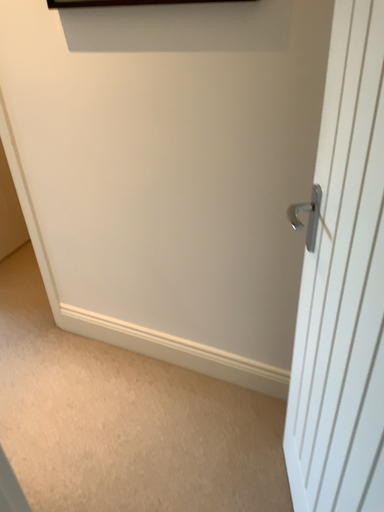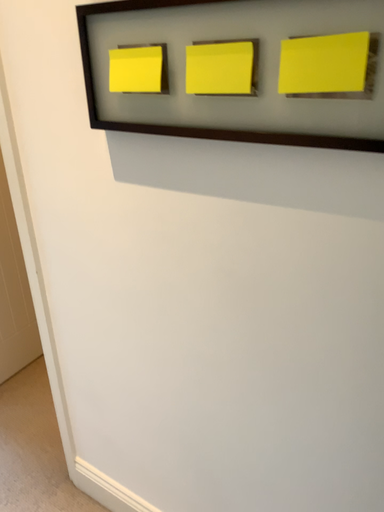
Question: How did the camera likely rotate when shooting the video?

Choices:
 (A) rotated downward
 (B) rotated upward

Answer: (B)